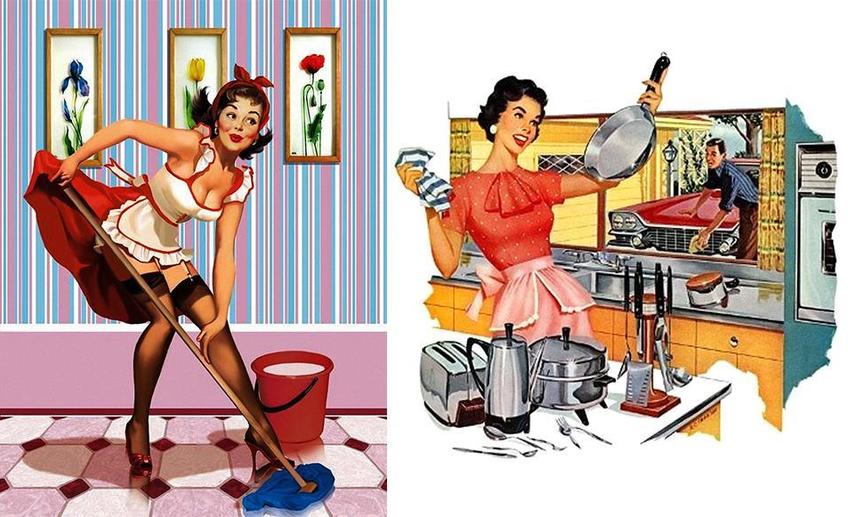
In order to click on toaster in this screenshot , I will do `click(459, 385)`.